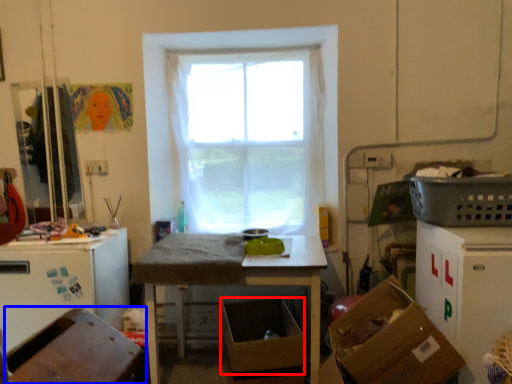
Question: Which of the following is the farthest to the observer, cardboard box (highlighted by a red box) or chair (highlighted by a blue box)?

Choices:
 (A) cardboard box
 (B) chair

Answer: (A)